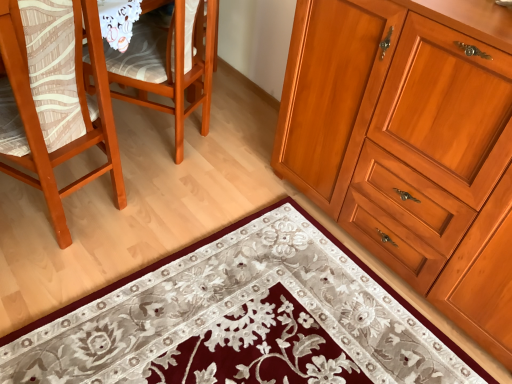
Locate an element on the screen. free region under matte wood chair at left, the second chair when ordered from right to left (from a real-world perspective) is located at coordinates (64, 209).